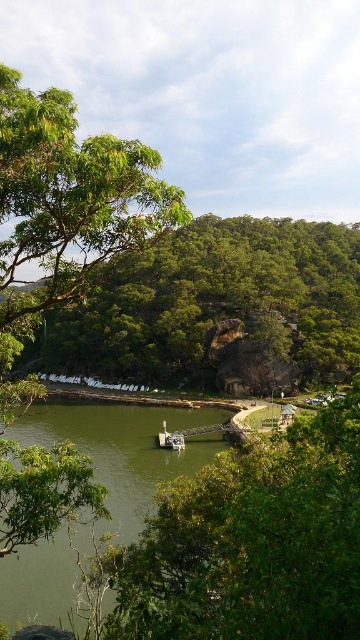
You are standing at the point marked as point (253, 541) in the image. What is directly beneath your feet?

The point (253, 541) is on a green leafy tree at lower center, so the ground beneath your feet would be part of that tree.